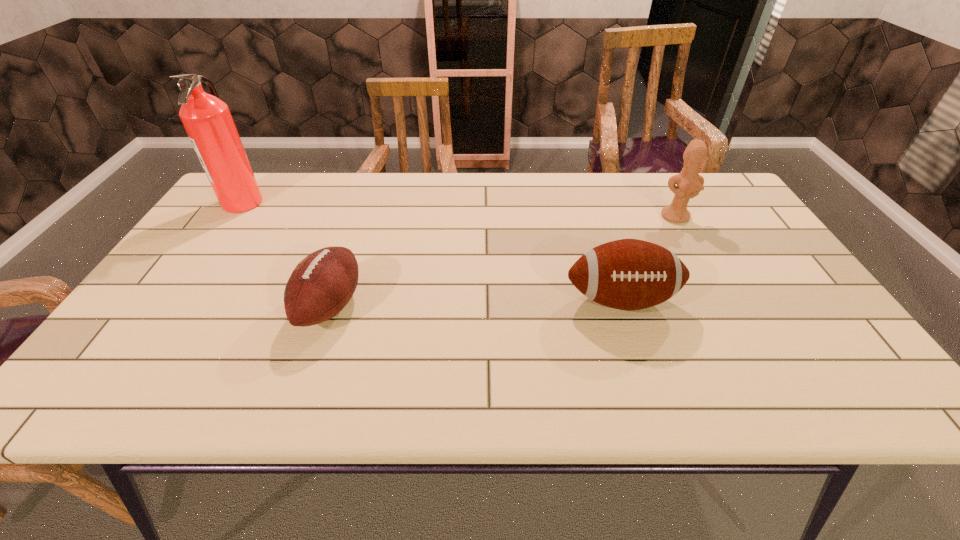
Where is `the tallest object`? This screenshot has width=960, height=540. the tallest object is located at coordinates (207, 120).

Where is `the leftmost object`? The height and width of the screenshot is (540, 960). the leftmost object is located at coordinates (207, 120).

At what (x,y) coordinates should I click in order to perform the action: click on the second tallest object. Please return your answer as a coordinate pair (x, y). Image resolution: width=960 pixels, height=540 pixels. Looking at the image, I should click on (689, 183).

Where is `figurine`? This screenshot has width=960, height=540. figurine is located at coordinates (689, 183).

The height and width of the screenshot is (540, 960). I want to click on the right football (American), so click(628, 274).

Where is `the shorter football (American)`? This screenshot has height=540, width=960. the shorter football (American) is located at coordinates (321, 285).

Locate an element on the screen. the second object from left to right is located at coordinates (321, 285).

Find the location of `vacant region located 0.350m at the nozzle of the fire extinguisher`. vacant region located 0.350m at the nozzle of the fire extinguisher is located at coordinates (376, 202).

The image size is (960, 540). I want to click on blank space located on the front-facing side of the rightmost object, so pyautogui.click(x=732, y=319).

The height and width of the screenshot is (540, 960). What are the coordinates of `free point located 0.100m on the laces of the right football (American)` in the screenshot? It's located at (641, 363).